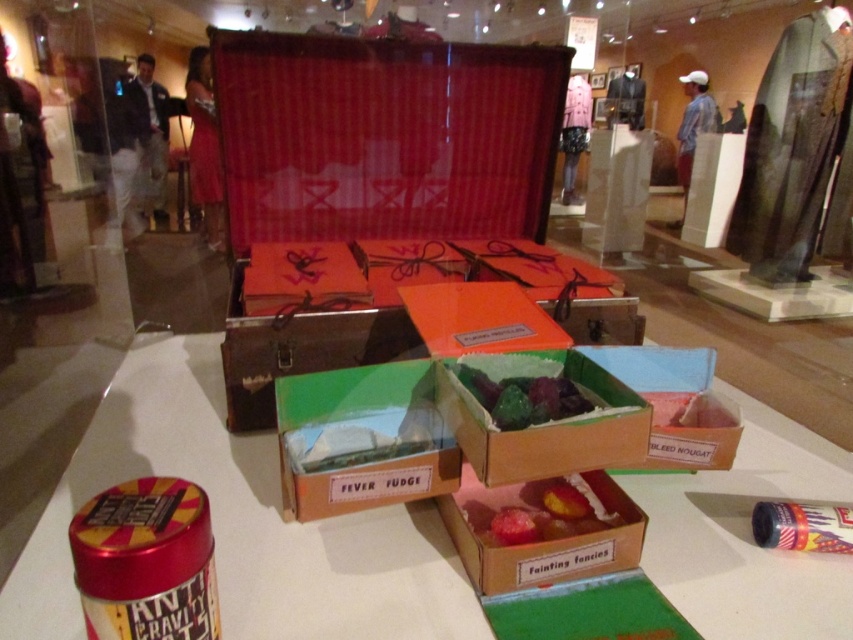
Question: Based on their relative distances, which object is nearer to the shiny pink candy at center?

Choices:
 (A) white glossy candy at center
 (B) shiny green candy at center

Answer: (B)

Question: Does brown cardboard boxes at center appear over cardboard box with colorful candies at center?

Choices:
 (A) no
 (B) yes

Answer: (B)

Question: Which object is the farthest from the green cardboard box at center?

Choices:
 (A) white glossy candy at center
 (B) cardboard box at center

Answer: (B)

Question: Is the position of brown cardboard boxes at center more distant than that of cardboard box at center?

Choices:
 (A) no
 (B) yes

Answer: (A)

Question: Which of the following is the closest to the observer?

Choices:
 (A) (582, 540)
 (B) (262, 465)

Answer: (A)

Question: Does brown cardboard boxes at center have a greater width compared to green cardboard box at center?

Choices:
 (A) no
 (B) yes

Answer: (B)